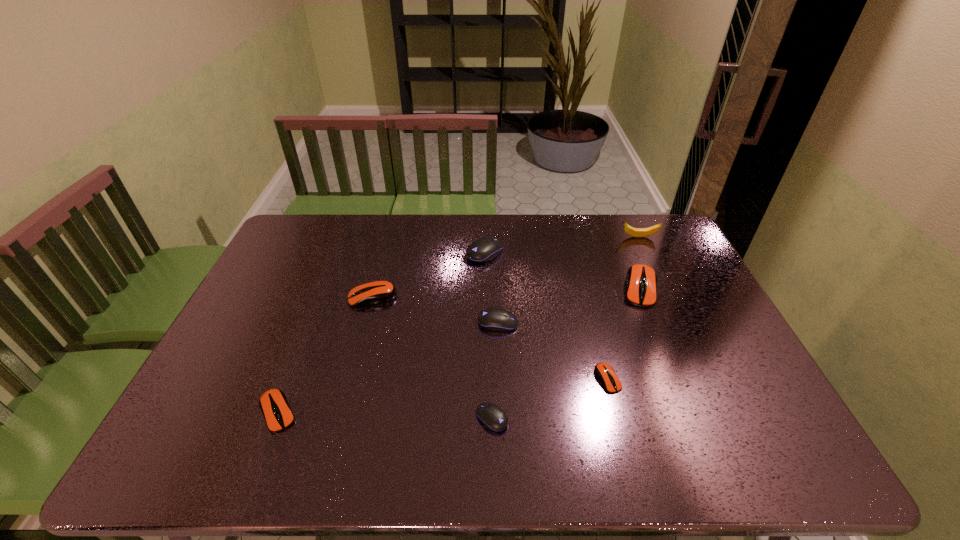
You are a GUI agent. You are given a task and a screenshot of the screen. Output one action in this format:
    pyautogui.click(x=<x>, y=<y>)
    Task: Click on the vacant space at the far edge of the desktop
    The height and width of the screenshot is (540, 960).
    Given the screenshot: What is the action you would take?
    tap(597, 239)

In the image, there is a desktop. At what (x,y) coordinates should I click in order to perform the action: click on free space at the near edge. Please return your answer as a coordinate pair (x, y). Looking at the image, I should click on (476, 435).

At what (x,y) coordinates should I click in order to perform the action: click on vacant region at the left edge of the desktop. Please return your answer as a coordinate pair (x, y). This screenshot has height=540, width=960. Looking at the image, I should click on (258, 361).

This screenshot has width=960, height=540. What are the coordinates of `free space at the right edge` in the screenshot? It's located at (670, 255).

You are a GUI agent. You are given a task and a screenshot of the screen. Output one action in this format:
    pyautogui.click(x=<x>, y=<y>)
    Task: Click on the vacant space at the near left corner
    The image size is (960, 540).
    Given the screenshot: What is the action you would take?
    pyautogui.click(x=181, y=450)

Where is `free location at the far right corner of the desktop`? This screenshot has width=960, height=540. free location at the far right corner of the desktop is located at coordinates (680, 244).

Locate an element on the screen. vacant area at the near right corner is located at coordinates (773, 450).

In order to click on vacant area that lies between the tallest object and the second computer mouse from right to left in this screenshot , I will do `click(623, 308)`.

Where is `empty space between the smallest black computer mouse and the leftmost orange computer mouse`? This screenshot has width=960, height=540. empty space between the smallest black computer mouse and the leftmost orange computer mouse is located at coordinates (385, 415).

Where is `empty space between the smallest black computer mouse and the farthest computer mouse`? Image resolution: width=960 pixels, height=540 pixels. empty space between the smallest black computer mouse and the farthest computer mouse is located at coordinates (489, 336).